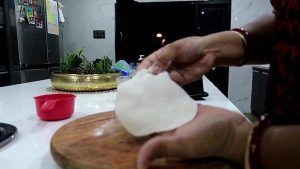
Locate an element on the screen. The image size is (300, 169). wooden cutting board is located at coordinates click(87, 149).